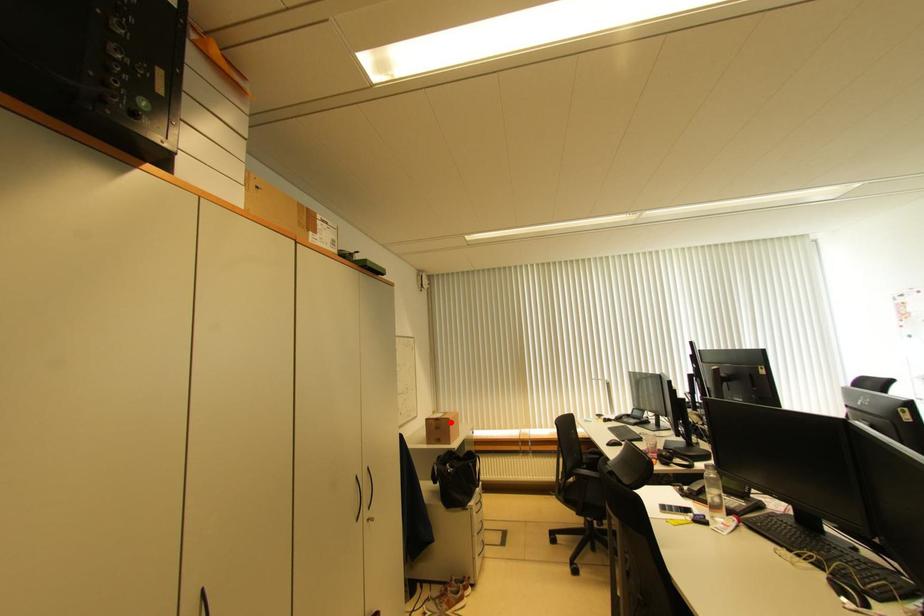
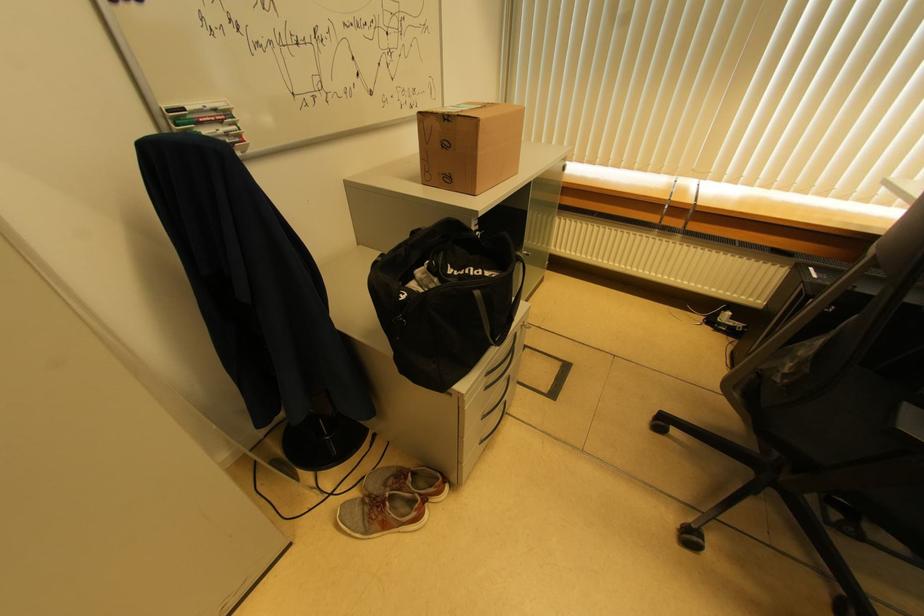
In the second image, find the point that corresponds to the highlighted location in the first image.

(477, 124)